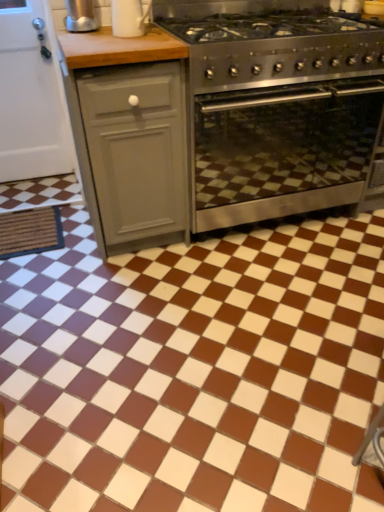
Locate an element on the screen. vacant area that is in front of white glossy mug at upper center is located at coordinates (142, 37).